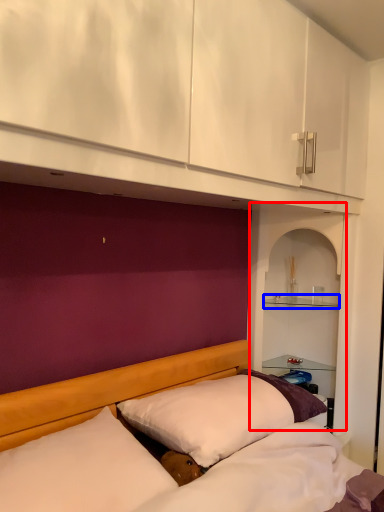
Question: Which of the following is the closest to the observer, shelf (highlighted by a red box) or shelf (highlighted by a blue box)?

Choices:
 (A) shelf
 (B) shelf

Answer: (A)